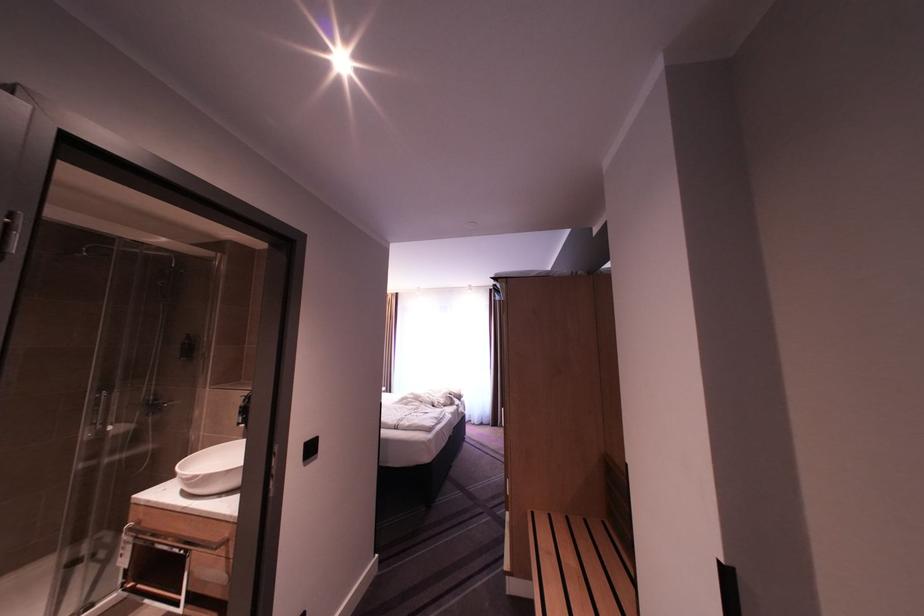
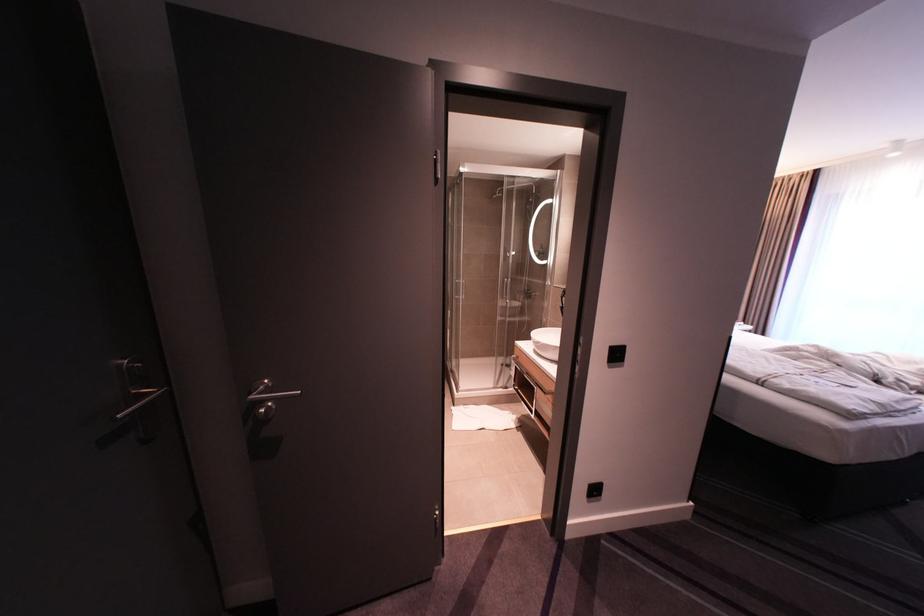
Question: The first image is from the beginning of the video and the second image is from the end. How did the camera likely rotate when shooting the video?

Choices:
 (A) Left
 (B) Right
 (C) Up
 (D) Down

Answer: (A)